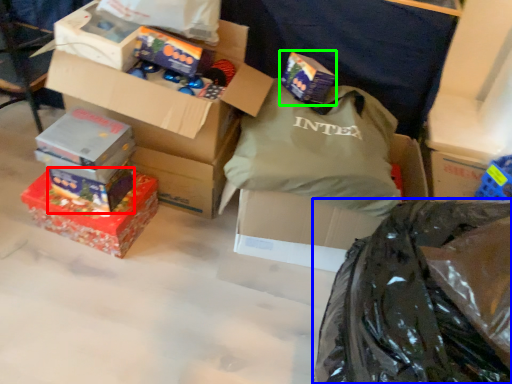
Question: Which object is the closest to the box (highlighted by a red box)? Choose among these: plastic bag (highlighted by a blue box) or gift (highlighted by a green box).

Choices:
 (A) plastic bag
 (B) gift

Answer: (B)